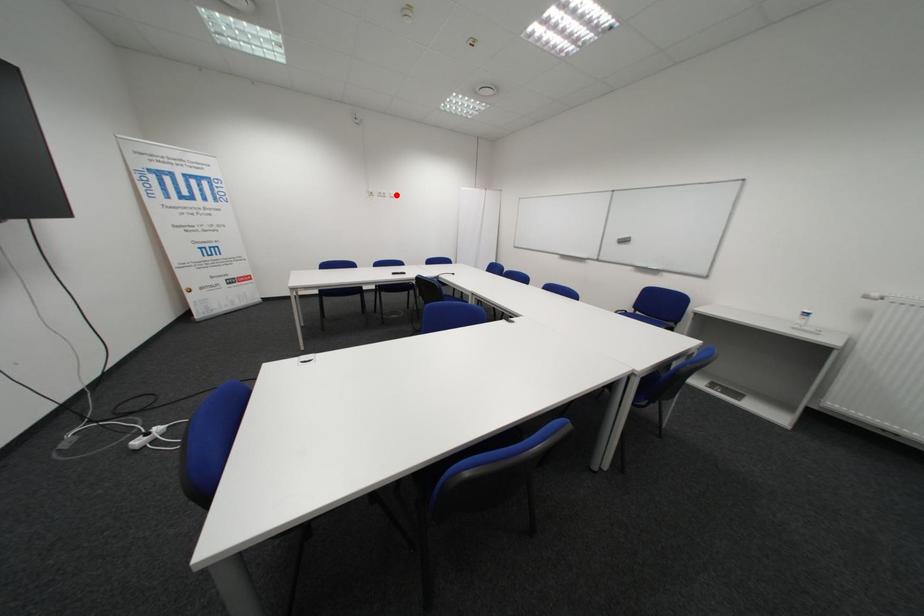
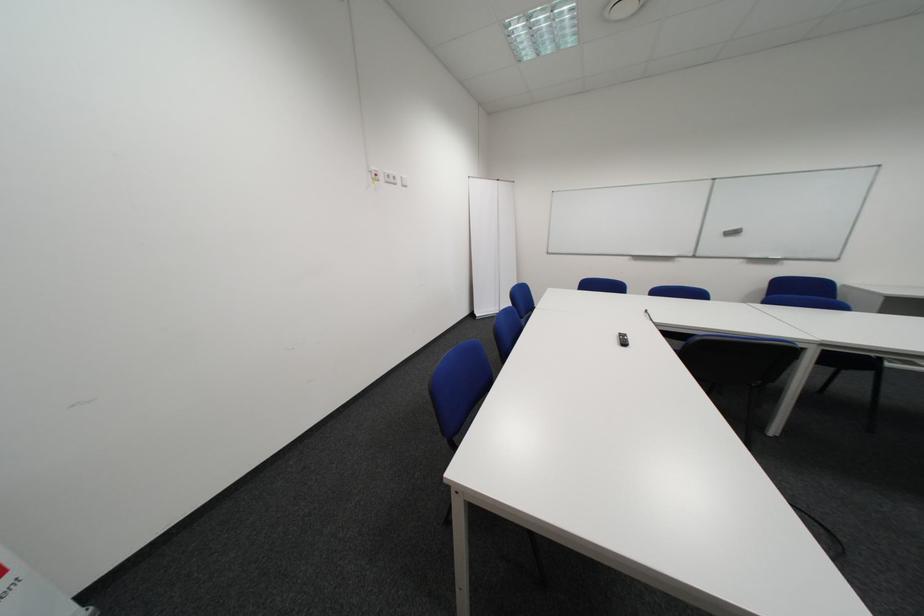
Find the pixel in the second image that matches the highlighted location in the first image.

(407, 179)